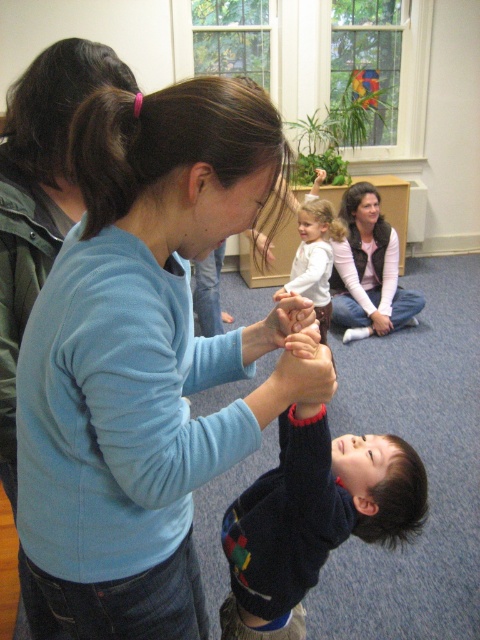
Question: Which point appears closest to the camera in this image?

Choices:
 (A) (355, 529)
 (B) (314, 278)
 (C) (350, 253)

Answer: (A)

Question: Among these points, which one is farthest from the camera?

Choices:
 (A) (370, 250)
 (B) (304, 525)
 (C) (307, 234)
 (D) (208, 220)

Answer: (A)

Question: Does dark blue sweater at center come in front of matte pink sweater at upper right?

Choices:
 (A) yes
 (B) no

Answer: (A)

Question: Does dark blue sweater at center appear on the right side of white soft shirt at center?

Choices:
 (A) yes
 (B) no

Answer: (B)

Question: Does blue matte sweater at center have a smaller size compared to matte pink sweater at upper right?

Choices:
 (A) no
 (B) yes

Answer: (A)

Question: Which object is farther from the camera taking this photo?

Choices:
 (A) matte pink sweater at upper right
 (B) dark blue sweater at center

Answer: (A)